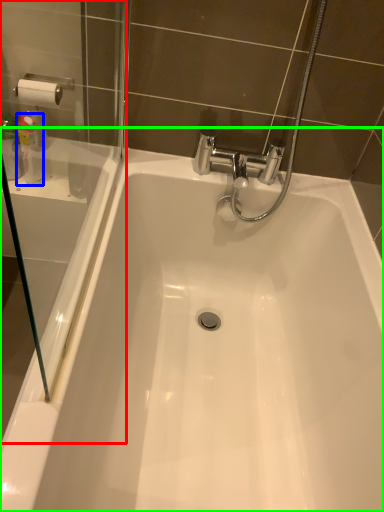
Question: Estimate the real-world distances between objects in this image. Which object is closer to screen door (highlighted by a red box), cleaning product (highlighted by a blue box) or bathtub (highlighted by a green box)?

Choices:
 (A) cleaning product
 (B) bathtub

Answer: (A)